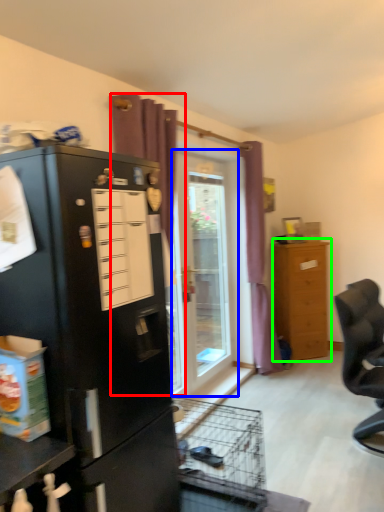
Question: Estimate the real-world distances between objects in this image. Which object is closer to curtain (highlighted by a red box), door (highlighted by a blue box) or chest of drawers (highlighted by a green box)?

Choices:
 (A) door
 (B) chest of drawers

Answer: (A)